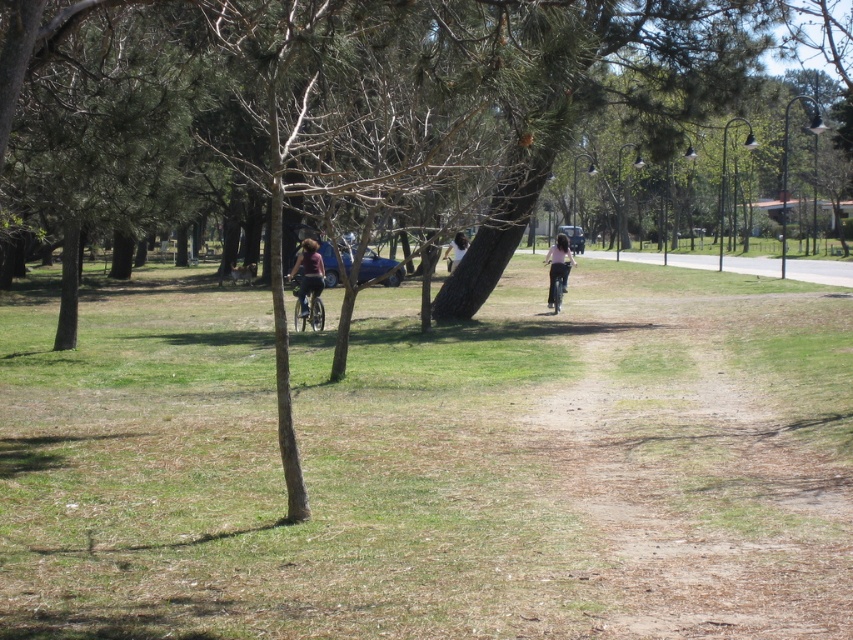
Question: Among these objects, which one is nearest to the camera?

Choices:
 (A) pink fabric pants at center
 (B) white shirt at center

Answer: (B)

Question: Does shiny metallic bicycle at center-left have a smaller size compared to white shirt at center?

Choices:
 (A) yes
 (B) no

Answer: (B)

Question: Which object is positioned farthest from the shiny metallic bicycle at center-left?

Choices:
 (A) pink fabric pants at center
 (B) white shirt at center
 (C) matte purple shirt at center

Answer: (A)

Question: Does shiny metallic bicycle at center-left come behind white shirt at center?

Choices:
 (A) yes
 (B) no

Answer: (B)

Question: Which point is farther from the camera taking this photo?

Choices:
 (A) (311, 268)
 (B) (514, 289)
 (C) (299, 278)
 (D) (444, 259)

Answer: (D)

Question: Does green grass at center have a greater width compared to matte purple shirt at center?

Choices:
 (A) no
 (B) yes

Answer: (B)